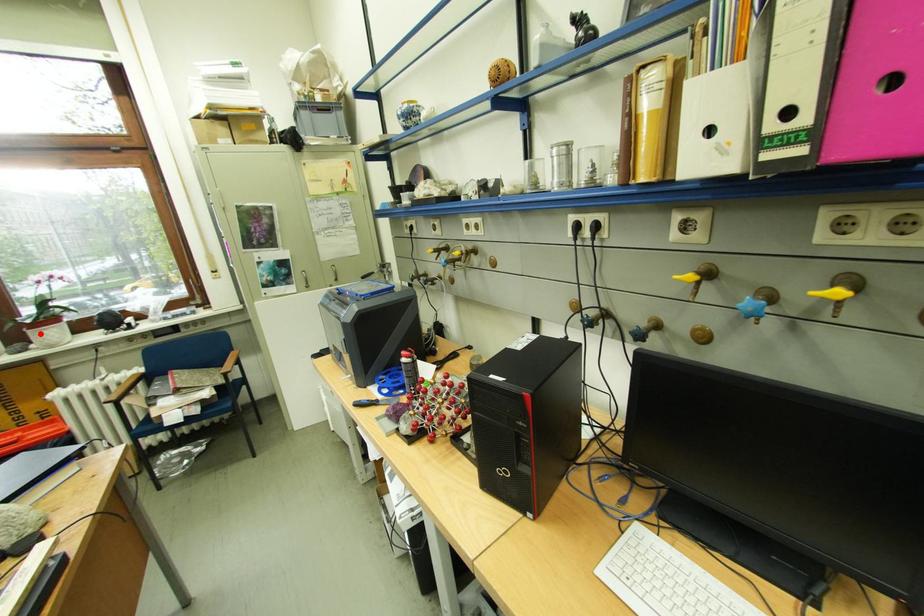
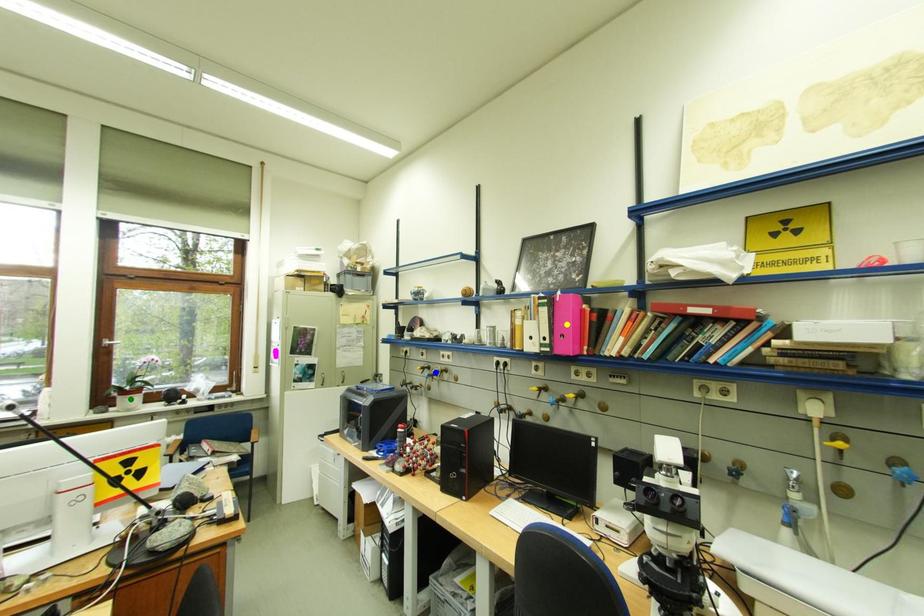
Question: I am providing you with two images of the same scene from different viewpoints. A red point is marked on the first image. You are given multiple points on the second image. Can you choose the point in image 2 that corresponds to the point in image 1?

Choices:
 (A) green point
 (B) blue point
 (C) yellow point

Answer: (A)